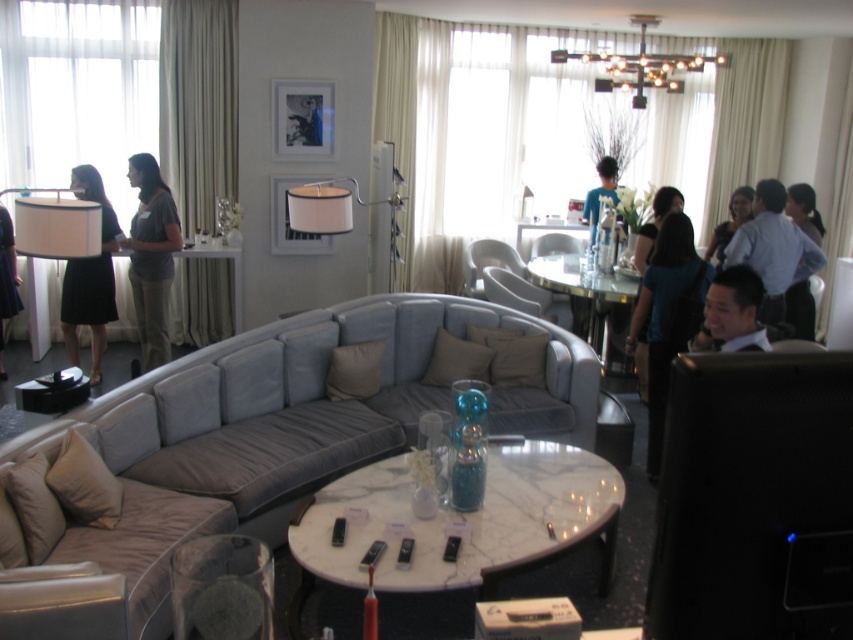
Question: Among these points, which one is nearest to the camera?

Choices:
 (A) (648, 237)
 (B) (155, 189)
 (C) (761, 224)
 (D) (531, 323)

Answer: (C)

Question: Can you confirm if blue shirt at right is smaller than black fabric shirt at right?

Choices:
 (A) yes
 (B) no

Answer: (B)

Question: Which point is closer to the camera?

Choices:
 (A) (479, 256)
 (B) (144, 538)
 (C) (546, 253)

Answer: (B)

Question: Which object is closer to the camera taking this photo?

Choices:
 (A) blue velvet shirt at upper center
 (B) gray cotton shirt at left
 (C) suede armchair at center

Answer: (B)

Question: Is black glass chandelier at upper center bigger than black dress at left?

Choices:
 (A) yes
 (B) no

Answer: (A)

Question: Is blue shirt at right behind black glossy suit at right?

Choices:
 (A) no
 (B) yes

Answer: (B)